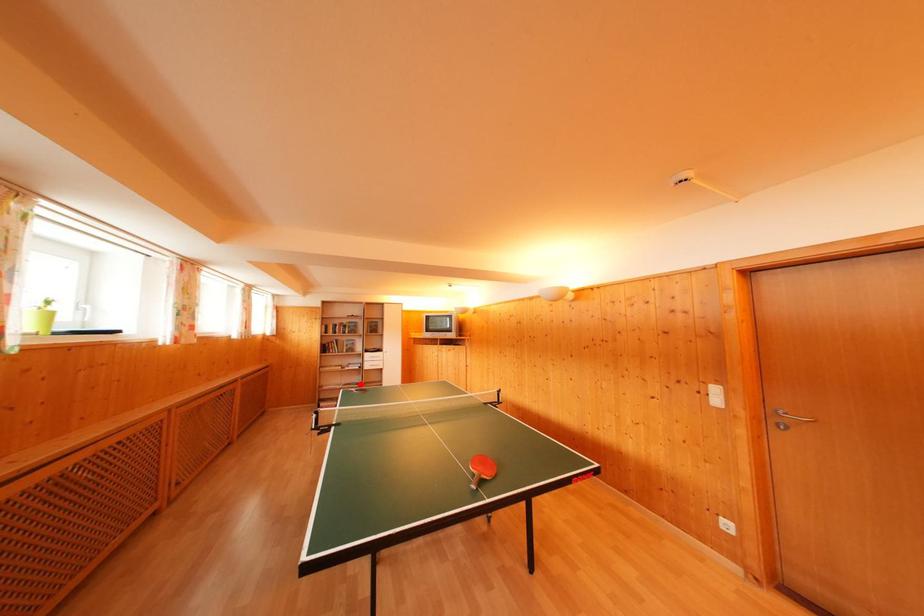
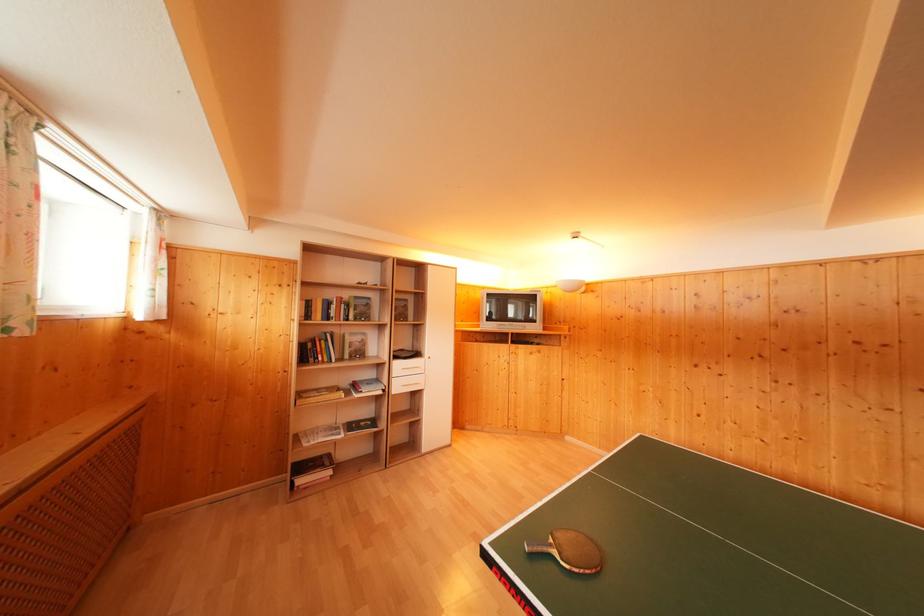
The point at the highlighted location is marked in the first image. Where is the corresponding point in the second image?

(371, 416)